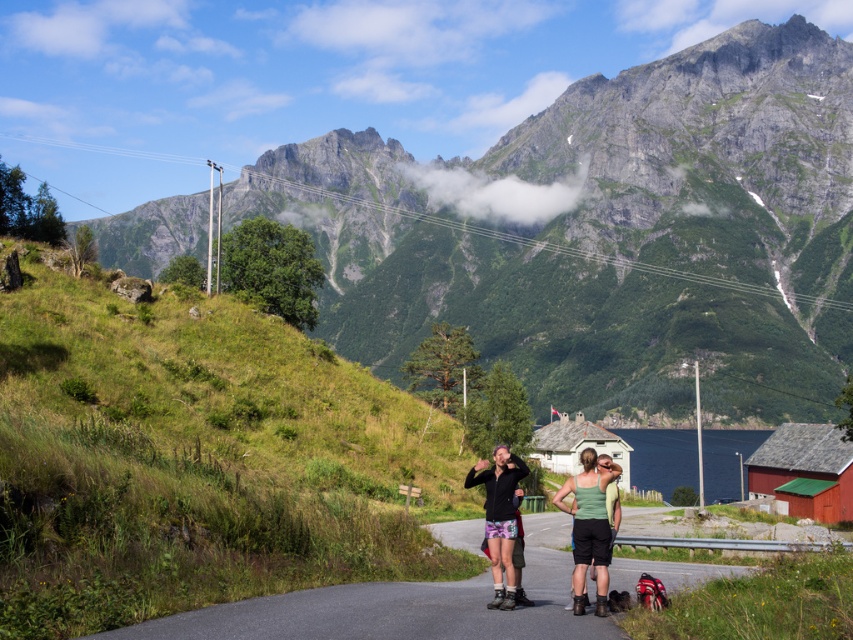
Does gray rocky mountain at upper center appear on the right side of green fabric tank top at center?

Incorrect, gray rocky mountain at upper center is not on the right side of green fabric tank top at center.

Does gray rocky mountain at upper center appear on the left side of green fabric tank top at center?

Yes, gray rocky mountain at upper center is to the left of green fabric tank top at center.

What do you see at coordinates (611, 234) in the screenshot? Image resolution: width=853 pixels, height=640 pixels. I see `gray rocky mountain at upper center` at bounding box center [611, 234].

This screenshot has height=640, width=853. I want to click on gray rocky mountain at upper center, so click(x=611, y=234).

Between green fabric tank top at center and matte black jacket at center, which one is positioned higher?

Positioned higher is matte black jacket at center.

Can you confirm if green fabric tank top at center is positioned above matte black jacket at center?

Incorrect, green fabric tank top at center is not positioned above matte black jacket at center.

What do you see at coordinates (589, 525) in the screenshot? I see `green fabric tank top at center` at bounding box center [589, 525].

The image size is (853, 640). I want to click on green fabric tank top at center, so click(589, 525).

How far apart are gray rocky mountain at upper center and matte black jacket at center?

gray rocky mountain at upper center is 1383.78 feet away from matte black jacket at center.

Does point (358, 212) come in front of point (514, 580)?

No, (358, 212) is further to viewer.

Where is `gray rocky mountain at upper center`? Image resolution: width=853 pixels, height=640 pixels. gray rocky mountain at upper center is located at coordinates (611, 234).